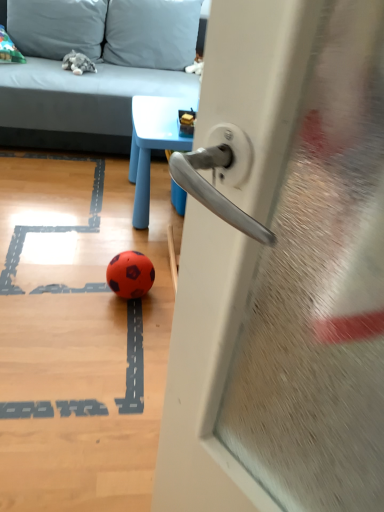
This screenshot has width=384, height=512. I want to click on free space in front of blue plastic table at upper center, so click(113, 242).